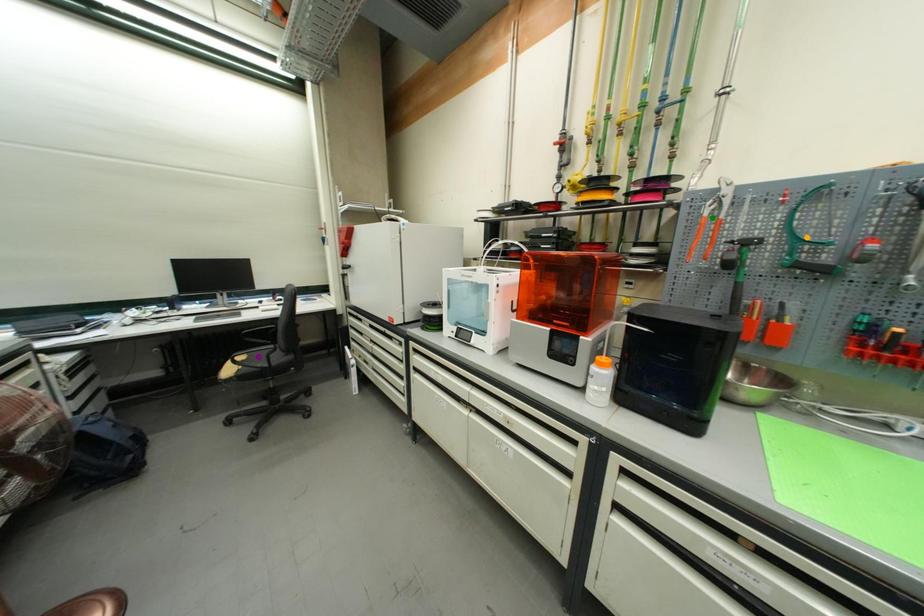
Order these from nearest to farthest:
green point, orange point, purple point

orange point → green point → purple point